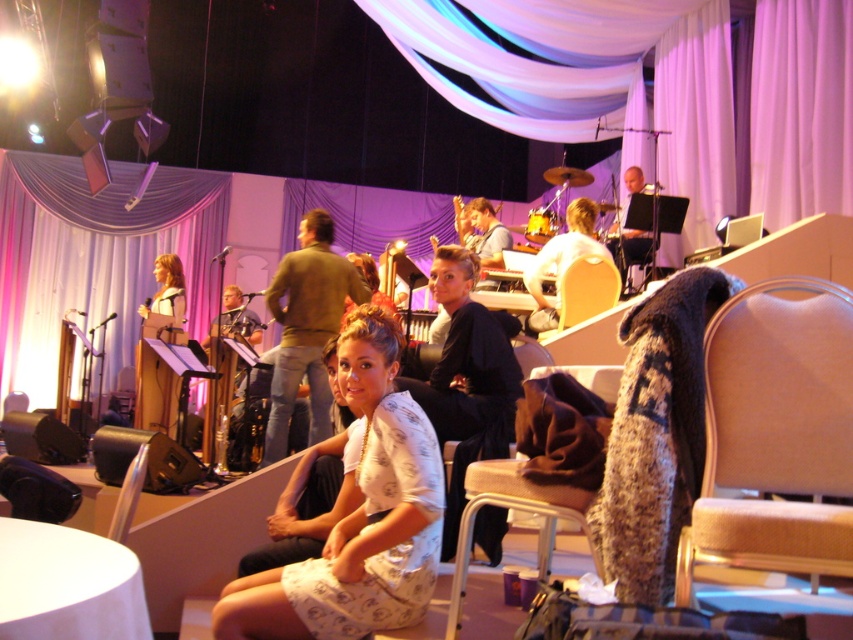
This screenshot has width=853, height=640. What are the coordinates of `white drapery at upper left` in the screenshot? It's located at (94, 260).

Is white drapery at upper left to the left of brown fabric chair at lower right from the viewer's perspective?

Yes, white drapery at upper left is to the left of brown fabric chair at lower right.

At what (x,y) coordinates should I click in order to perform the action: click on white drapery at upper left. Please return your answer as a coordinate pair (x, y). The height and width of the screenshot is (640, 853). Looking at the image, I should click on (94, 260).

Where is `white drapery at upper left`? The width and height of the screenshot is (853, 640). white drapery at upper left is located at coordinates (94, 260).

Does beige fabric chair at center appear on the left side of white drapery at upper left?

In fact, beige fabric chair at center is to the right of white drapery at upper left.

Which is more to the left, beige fabric chair at center or white drapery at upper left?

From the viewer's perspective, white drapery at upper left appears more on the left side.

Is point (724, 465) more distant than point (97, 275)?

No, (724, 465) is in front of (97, 275).

You are a GUI agent. You are given a task and a screenshot of the screen. Output one action in this format:
    pyautogui.click(x=<x>, y=<y>)
    Task: Click on the beige fabric chair at center
    Image resolution: width=853 pixels, height=640 pixels.
    Given the screenshot: What is the action you would take?
    pyautogui.click(x=775, y=435)

Which is more to the right, beige fabric chair at center or green sweater at center?

Positioned to the right is beige fabric chair at center.

Which is in front, point (706, 333) or point (318, 240)?

Positioned in front is point (706, 333).

Is point (825, 556) in front of point (300, 221)?

Yes, it is in front of point (300, 221).

What are the coordinates of `beige fabric chair at center` in the screenshot? It's located at (775, 435).